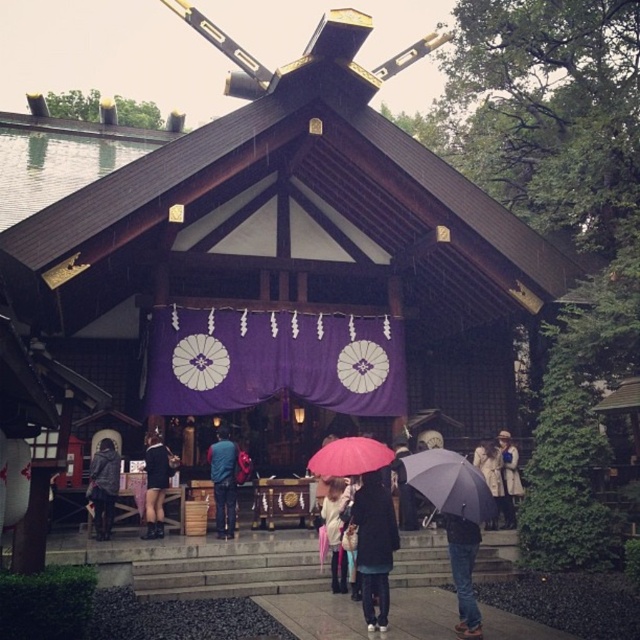
You are a photographer planning to capture a detailed shot of the shrine entrance. You notice the dark gray fabric jacket at lower left and the white cotton scarf at center. Which object should you focus on first if you want to ensure both are in the frame without moving the camera? Explain your reasoning based on their sizes.

The dark gray fabric jacket at lower left has a larger size compared to the white cotton scarf at center. Since it is larger, focusing on the jacket first would allow the scarf to remain within the frame more easily, as the camera can adjust to include both without needing to reposition.

You are standing at the entrance of the shrine and want to place a small offering at the exact center of the shrine. The shrine is represented by a coordinate system where the entrance is at the origin. Given the coordinates of the black leather shorts at center, can you determine if placing the offering at those coordinates would be appropriate?

The black leather shorts at center is located at point (156, 483), which is not the exact center of the shrine. Therefore, placing the offering at those coordinates would not be appropriate as it deviates from the central point.

You are a visitor at the shrine and want to place both the pink matte umbrella at center and the white cotton scarf at center on the shrine entrance shelf. The shelf is 1.2 meters wide. Can both items fit side by side?

The pink matte umbrella at center is wider than the white cotton scarf at center. However, since the shelf is 1.2 meters wide, both items can fit side by side as long as their combined widths do not exceed the shelf length. Unfortunately, the exact widths are not provided, so we cannot confirm for sure. Please check the actual measurements.